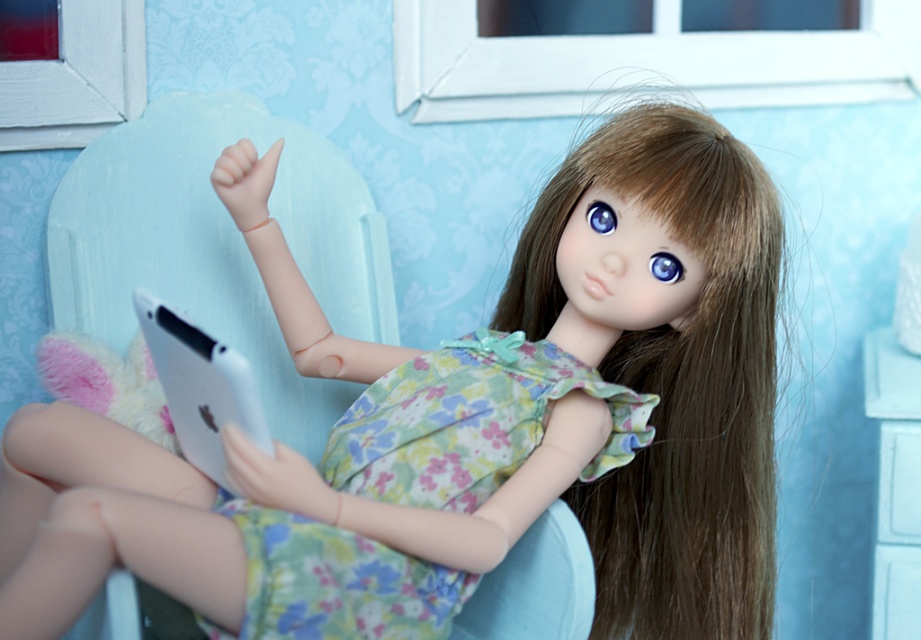
Question: Does brown silky hair at center appear on the right side of floral fabric dress at center?

Choices:
 (A) no
 (B) yes

Answer: (B)

Question: Where is brown silky hair at center located in relation to floral fabric dress at center in the image?

Choices:
 (A) right
 (B) left

Answer: (A)

Question: Can you confirm if brown silky hair at center is smaller than floral fabric dress at center?

Choices:
 (A) yes
 (B) no

Answer: (B)

Question: Which point is closer to the camera?

Choices:
 (A) (758, 326)
 (B) (241, 528)

Answer: (B)

Question: Which point appears farthest from the camera in this image?

Choices:
 (A) (479, 483)
 (B) (659, 371)

Answer: (B)